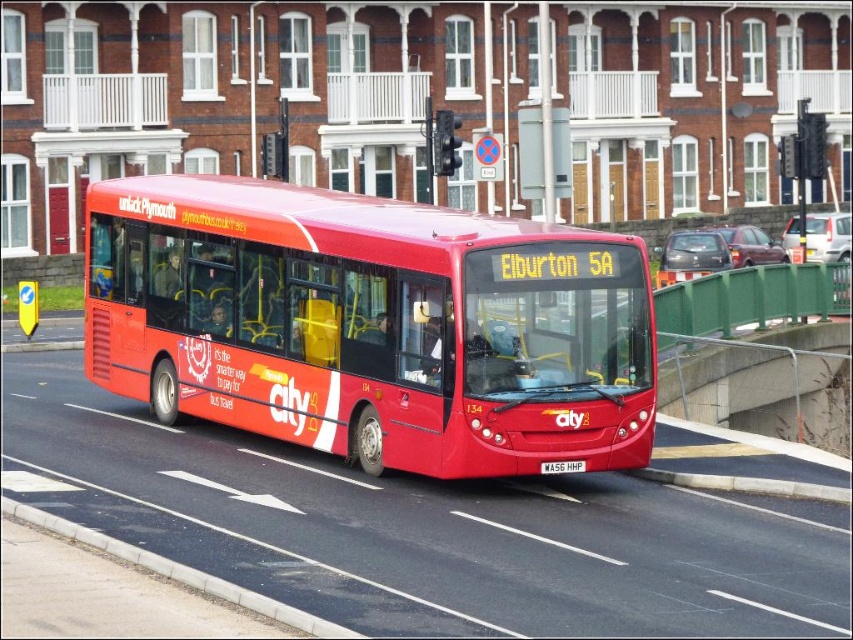
You are a driver approaching the white matte license plate at center and the black asphalt curb at lower left. Which object is positioned to the left of the other?

The black asphalt curb at lower left is positioned to the left of the white matte license plate at center.

You are a pedestrian standing on the sidewalk and looking at the black asphalt curb at lower left and the white matte license plate at center. Which object is nearer to you?

The black asphalt curb at lower left is closer to the viewer than the white matte license plate at center.